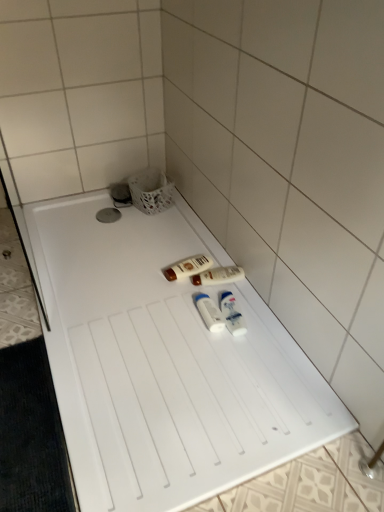
Question: Is matte brown lotion at center, placed as the first toiletry when sorted from back to front, looking in the opposite direction of white plastic bottles at center, the fourth toiletry positioned from the back?

Choices:
 (A) yes
 (B) no

Answer: (B)

Question: Does matte brown lotion at center, placed as the first toiletry when sorted from back to front, have a greater width compared to white plastic bottles at center, the fourth toiletry positioned from the back?

Choices:
 (A) no
 (B) yes

Answer: (B)

Question: Does matte brown lotion at center, placed as the first toiletry when sorted from back to front, turn towards white plastic bottles at center, the fourth toiletry positioned from the back?

Choices:
 (A) no
 (B) yes

Answer: (A)

Question: Is white plastic bottles at center, the 1th toiletry from the front, inside matte brown lotion at center, which is counted as the 4th toiletry, starting from the front?

Choices:
 (A) yes
 (B) no

Answer: (B)

Question: From a real-world perspective, is matte brown lotion at center, which is counted as the 4th toiletry, starting from the front, located higher than white plastic bottles at center, the 1th toiletry from the front?

Choices:
 (A) yes
 (B) no

Answer: (B)

Question: Is matte brown lotion at center, placed as the first toiletry when sorted from back to front, to the left or to the right of white plastic bottles at center, the 1th toiletry from the front, in the image?

Choices:
 (A) right
 (B) left

Answer: (B)

Question: In the image, is matte brown lotion at center, placed as the first toiletry when sorted from back to front, positioned in front of or behind white plastic bottles at center, the 1th toiletry from the front?

Choices:
 (A) behind
 (B) front

Answer: (A)

Question: Considering the positions of point (170, 278) and point (226, 300), is point (170, 278) closer or farther from the camera than point (226, 300)?

Choices:
 (A) closer
 (B) farther

Answer: (B)

Question: From the image's perspective, relative to white plastic bottles at center, the 1th toiletry from the front, is matte brown lotion at center, placed as the first toiletry when sorted from back to front, above or below?

Choices:
 (A) below
 (B) above

Answer: (B)

Question: From the image's perspective, is matte brown lotion at center, which is counted as the 4th toiletry, starting from the front, positioned above or below white plastic tubes at center, which is counted as the second toiletry, starting from the front?

Choices:
 (A) above
 (B) below

Answer: (A)

Question: Is point (167, 267) positioned closer to the camera than point (215, 326)?

Choices:
 (A) closer
 (B) farther

Answer: (B)

Question: In terms of width, does matte brown lotion at center, which is counted as the 4th toiletry, starting from the front, look wider or thinner when compared to white plastic tubes at center, which is counted as the second toiletry, starting from the front?

Choices:
 (A) wide
 (B) thin

Answer: (A)

Question: From a real-world perspective, relative to white plastic tubes at center, which is counted as the second toiletry, starting from the front, is matte brown lotion at center, which is counted as the 4th toiletry, starting from the front, vertically above or below?

Choices:
 (A) above
 (B) below

Answer: (B)

Question: From the image's perspective, is white plastic bottles at center, the 1th toiletry from the front, positioned above or below white glossy lotion at center, the third toiletry from the front?

Choices:
 (A) below
 (B) above

Answer: (A)

Question: Is white plastic bottles at center, the fourth toiletry positioned from the back, bigger or smaller than white glossy lotion at center, the third toiletry from the front?

Choices:
 (A) big
 (B) small

Answer: (B)